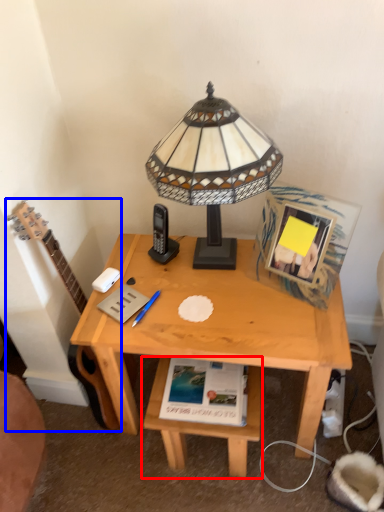
Question: Which object is closer to the camera taking this photo, table (highlighted by a red box) or guitar (highlighted by a blue box)?

Choices:
 (A) table
 (B) guitar

Answer: (B)